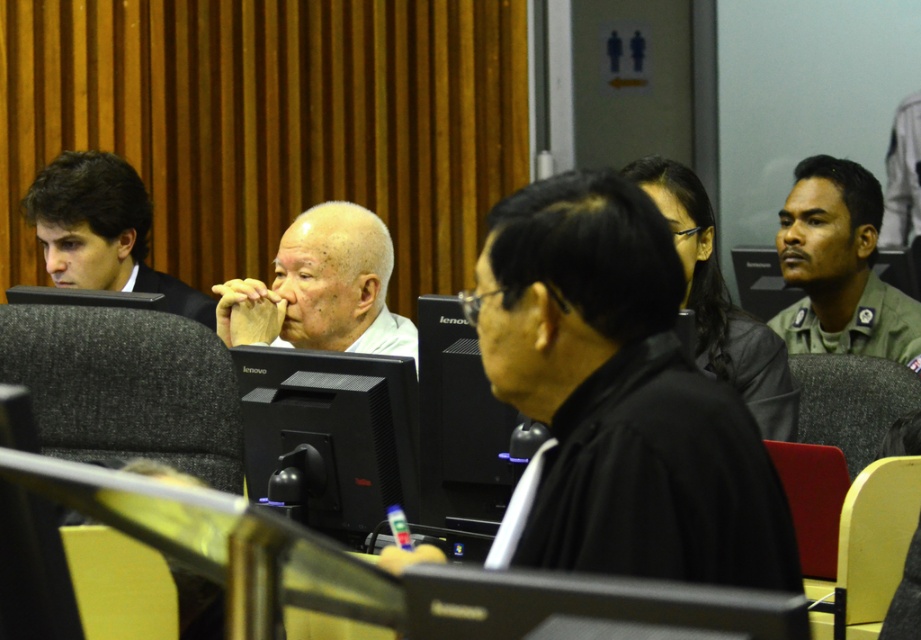
What do you see at coordinates (329, 435) in the screenshot? I see `black matte monitor at center` at bounding box center [329, 435].

Which is behind, point (391, 396) or point (318, 204)?

Positioned behind is point (318, 204).

Which is behind, point (344, 444) or point (293, 326)?

The point (293, 326) is behind.

At what (x,y) coordinates should I click in order to perform the action: click on black matte monitor at center. Please return your answer as a coordinate pair (x, y). Image resolution: width=921 pixels, height=640 pixels. Looking at the image, I should click on point(329,435).

Is black matte monitor at center shorter than dark brown hair at left?

Yes.

Is black matte monitor at center taller than dark brown hair at left?

No.

Between point (294, 406) and point (124, 256), which one is positioned behind?

The point (124, 256) is behind.

Locate an element on the screen. The width and height of the screenshot is (921, 640). black matte monitor at center is located at coordinates (329, 435).

Can you confirm if black matte robe at center is smaller than white matte bald head at center?

Actually, black matte robe at center might be larger than white matte bald head at center.

Does black matte robe at center have a lesser height compared to white matte bald head at center?

Incorrect, black matte robe at center's height does not fall short of white matte bald head at center's.

Who is more distant from viewer, (478, 257) or (315, 243)?

Positioned behind is point (478, 257).

The height and width of the screenshot is (640, 921). Find the location of `black matte robe at center`. black matte robe at center is located at coordinates (621, 396).